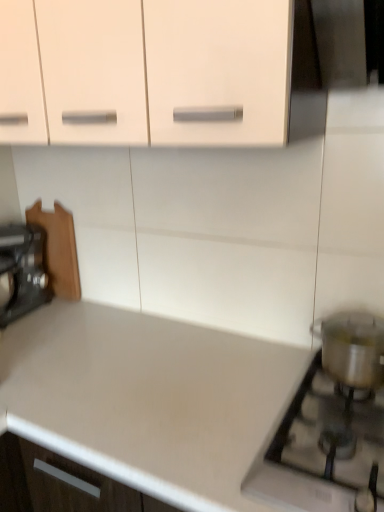
Measure the distance between point [35,263] and camera.

Point [35,263] and camera are 5.33 feet apart.

What do you see at coordinates (149, 72) in the screenshot?
I see `matte white cabinet at upper center` at bounding box center [149, 72].

The height and width of the screenshot is (512, 384). What do you see at coordinates (322, 450) in the screenshot?
I see `satin silver pot at lower right` at bounding box center [322, 450].

Where is `white matte countertop at lower right`? The image size is (384, 512). white matte countertop at lower right is located at coordinates (158, 405).

What's the angular difference between wooden cutting board at left and white matte countertop at lower right's facing directions?

wooden cutting board at left and white matte countertop at lower right are facing 3.96 degrees away from each other.

Do you think wooden cutting board at left is within white matte countertop at lower right, or outside of it?

The correct answer is: outside.

Is wooden cutting board at left not near white matte countertop at lower right?

No, wooden cutting board at left is not far away from white matte countertop at lower right.

Are wooden cutting board at left and matte white cabinet at upper center making contact?

No, wooden cutting board at left is not in contact with matte white cabinet at upper center.

Looking at this image, could you tell me if wooden cutting board at left is turned towards matte white cabinet at upper center?

No, wooden cutting board at left does not turn towards matte white cabinet at upper center.

Considering the sizes of objects wooden cutting board at left and matte white cabinet at upper center in the image provided, who is bigger, wooden cutting board at left or matte white cabinet at upper center?

matte white cabinet at upper center is bigger.

Is metallic silver pot at right with wooden cutting board at left?

No, metallic silver pot at right is not touching wooden cutting board at left.

From the image's perspective, between metallic silver pot at right and wooden cutting board at left, which one is located above?

wooden cutting board at left appears higher in the image.

Does metallic silver pot at right have a greater width compared to wooden cutting board at left?

No, metallic silver pot at right is not wider than wooden cutting board at left.

Is metallic silver pot at right bigger or smaller than wooden cutting board at left?

Considering their sizes, metallic silver pot at right takes up less space than wooden cutting board at left.

Which object is thinner, white matte countertop at lower right or metallic silver pot at right?

metallic silver pot at right is thinner.

Is white matte countertop at lower right next to metallic silver pot at right?

white matte countertop at lower right is not next to metallic silver pot at right, and they're not touching.

From a real-world perspective, is white matte countertop at lower right positioned above or below metallic silver pot at right?

Clearly, from a real-world perspective, white matte countertop at lower right is below metallic silver pot at right.

In the image, is satin silver pot at lower right positioned in front of or behind metallic silver pot at right?

Clearly, satin silver pot at lower right is in front of metallic silver pot at right.

The image size is (384, 512). What are the coordinates of `gas stove below the metallic silver pot at right (from the image's perspective)` in the screenshot? It's located at (322, 450).

Is satin silver pot at lower right not inside metallic silver pot at right?

That's correct, satin silver pot at lower right is outside of metallic silver pot at right.

Is satin silver pot at lower right far from metallic silver pot at right?

satin silver pot at lower right is actually quite close to metallic silver pot at right.

How different are the orientations of matte white cabinet at upper center and wooden cutting board at left in degrees?

3.65 degrees.

From a real-world perspective, is matte white cabinet at upper center on wooden cutting board at left?

Yes, from a real-world perspective, matte white cabinet at upper center is over wooden cutting board at left

Based on the photo, from the image's perspective, relative to wooden cutting board at left, is matte white cabinet at upper center above or below?

Based on their image positions, matte white cabinet at upper center is located above wooden cutting board at left.

Between matte white cabinet at upper center and wooden cutting board at left, which one has more height?

Standing taller between the two is matte white cabinet at upper center.

Where is `gas stove that is below the metallic silver pot at right (from the image's perspective)`? gas stove that is below the metallic silver pot at right (from the image's perspective) is located at coordinates (322, 450).

How different are the orientations of metallic silver pot at right and satin silver pot at lower right in degrees?

The angular difference between metallic silver pot at right and satin silver pot at lower right is 0.0983 degrees.

In the image, is metallic silver pot at right positioned in front of or behind satin silver pot at lower right?

metallic silver pot at right is behind satin silver pot at lower right.

From the image's perspective, is metallic silver pot at right over satin silver pot at lower right?

Indeed, from the image's perspective, metallic silver pot at right is shown above satin silver pot at lower right.

I want to click on kitchen appliance above the white matte countertop at lower right (from the image's perspective), so click(x=22, y=271).

In order to click on cabinetry located on the right of wooden cutting board at left in this screenshot , I will do `click(149, 72)`.

From the image, which object appears to be farther from white matte countertop at lower right, matte white cabinet at upper center or wooden cutting board at left?

matte white cabinet at upper center is further to white matte countertop at lower right.

Consider the image. Which object lies further to the anchor point white matte countertop at lower right, wooden cutting board at left or metallic silver pot at right?

wooden cutting board at left lies further to white matte countertop at lower right than the other object.

Looking at the image, which one is located further to metallic silver pot at right, wooden cutting board at left or matte white cabinet at upper center?

Based on the image, wooden cutting board at left appears to be further to metallic silver pot at right.

Considering their positions, is satin silver pot at lower right positioned closer to wooden cutting board at left than metallic silver pot at right?

metallic silver pot at right lies closer to wooden cutting board at left than the other object.

Considering their positions, is white matte countertop at lower right positioned further to matte white cabinet at upper center than satin silver pot at lower right?

Based on the image, satin silver pot at lower right appears to be further to matte white cabinet at upper center.

Based on their spatial positions, is white matte countertop at lower right or matte white cabinet at upper center closer to metallic silver pot at right?

Among the two, white matte countertop at lower right is located nearer to metallic silver pot at right.

Estimate the real-world distances between objects in this image. Which object is further from satin silver pot at lower right, wooden cutting board at left or metallic silver pot at right?

The object further to satin silver pot at lower right is wooden cutting board at left.

Looking at the image, which one is located further to satin silver pot at lower right, wooden cutting board at left or white matte countertop at lower right?

wooden cutting board at left is positioned further to the anchor satin silver pot at lower right.

You are a GUI agent. You are given a task and a screenshot of the screen. Output one action in this format:
    pyautogui.click(x=<x>, y=<y>)
    Task: Click on the gas stove between matte white cabinet at upper center and white matte countertop at lower right in the up-down direction
    
    Given the screenshot: What is the action you would take?
    pyautogui.click(x=322, y=450)

Find the location of `cabinetry located between wooden cutting board at left and satin silver pot at lower right in the left-right direction`. cabinetry located between wooden cutting board at left and satin silver pot at lower right in the left-right direction is located at coordinates (149, 72).

Find the location of a particular element. countertop between wooden cutting board at left and satin silver pot at lower right in the horizontal direction is located at coordinates (158, 405).

At what (x,y) coordinates should I click in order to perform the action: click on appliance that lies between matte white cabinet at upper center and white matte countertop at lower right from top to bottom. Please return your answer as a coordinate pair (x, y). Looking at the image, I should click on (352, 347).